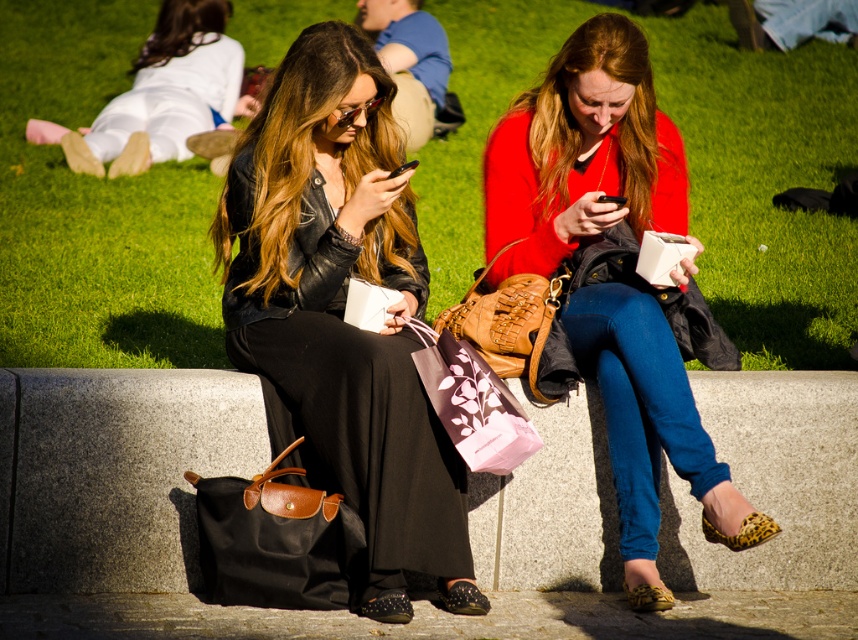
Is point (402, 333) positioned behind point (544, 355)?

No.

Which is above, matte black leather jacket at center or leather textured handbag at center?

leather textured handbag at center

Find the location of a particular element. This screenshot has width=858, height=640. matte black leather jacket at center is located at coordinates (343, 308).

The height and width of the screenshot is (640, 858). I want to click on matte black leather jacket at center, so click(x=343, y=308).

Who is more distant from viewer, (34, 420) or (713, 326)?

Point (713, 326)

Looking at this image, does black fabric bag at lower center have a greater height compared to white matte paper bag at center?

Correct, black fabric bag at lower center is much taller as white matte paper bag at center.

Is point (729, 397) less distant than point (619, 252)?

No, it is not.

Where is `black fabric bag at lower center`? Image resolution: width=858 pixels, height=640 pixels. black fabric bag at lower center is located at coordinates (115, 472).

Between point (701, 470) and point (445, 381), which one is positioned in front?

Positioned in front is point (445, 381).

Find the location of a particular element. The height and width of the screenshot is (640, 858). matte red sweater at center is located at coordinates (582, 154).

What do you see at coordinates (582, 154) in the screenshot?
I see `matte red sweater at center` at bounding box center [582, 154].

You are a GUI agent. You are given a task and a screenshot of the screen. Output one action in this format:
    pyautogui.click(x=<x>, y=<y>)
    Task: Click on the matte red sweater at center
    The height and width of the screenshot is (640, 858).
    Given the screenshot: What is the action you would take?
    pyautogui.click(x=582, y=154)